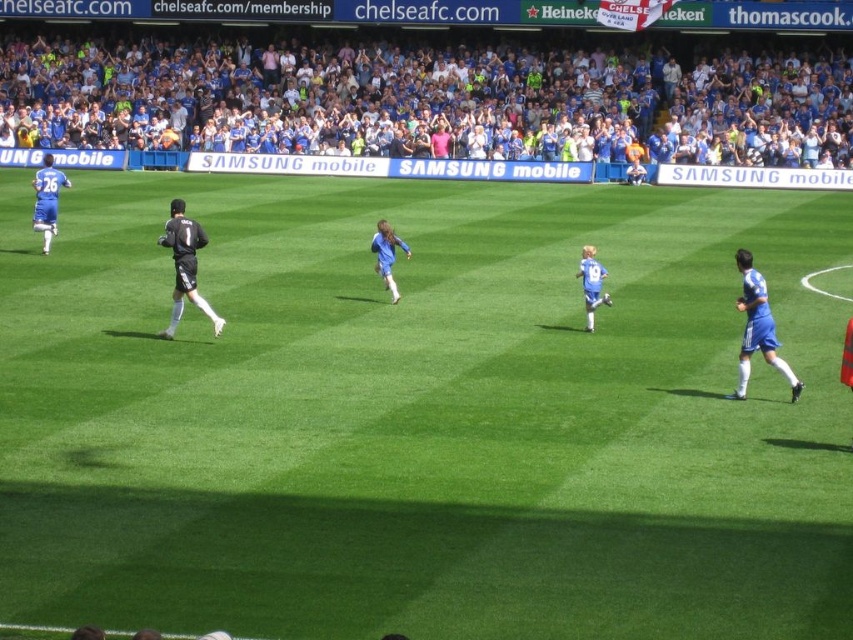
Question: Is blue fabric crowd at upper center below blue jersey at right?

Choices:
 (A) yes
 (B) no

Answer: (B)

Question: Is black matte jersey at center behind blue jersey soccer player at left?

Choices:
 (A) no
 (B) yes

Answer: (A)

Question: Can you confirm if green grass soccer field at center is positioned above black matte jersey at center?

Choices:
 (A) yes
 (B) no

Answer: (B)

Question: Which object appears farthest from the camera in this image?

Choices:
 (A) blue jersey at right
 (B) blue fabric crowd at upper center

Answer: (B)

Question: Estimate the real-world distances between objects in this image. Which object is closer to the black matte jersey at center?

Choices:
 (A) green grass soccer field at center
 (B) blue jersey soccer player at left
 (C) blue jersey at right

Answer: (C)

Question: Which is farther from the green grass soccer field at center?

Choices:
 (A) blue jersey soccer player at left
 (B) blue jersey at right
 (C) blue fabric crowd at upper center
 (D) black matte jersey at center

Answer: (C)